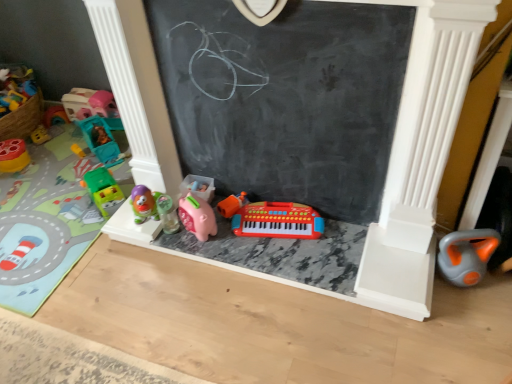
Locate an element on the screen. Image resolution: width=512 pixels, height=384 pixels. vacant area situated to the left side of green plastic toy car at left, the 5th toy in the left-to-right sequence is located at coordinates (71, 209).